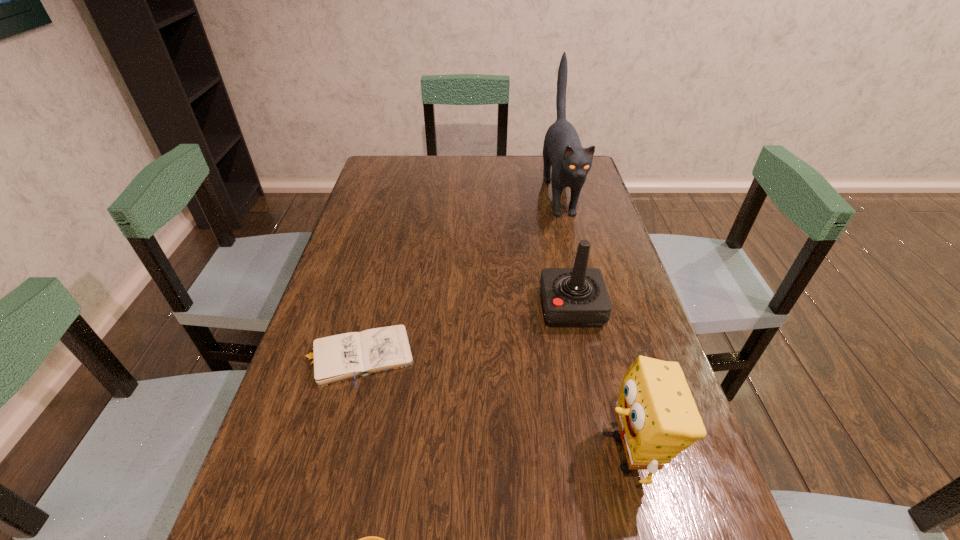
Where is `the farthest object`? This screenshot has width=960, height=540. the farthest object is located at coordinates (562, 150).

Identify the location of the tallest object. Image resolution: width=960 pixels, height=540 pixels. point(562,150).

Where is `joystick`? This screenshot has width=960, height=540. joystick is located at coordinates (572, 297).

This screenshot has width=960, height=540. In order to click on sponge in this screenshot , I will do 657,417.

This screenshot has width=960, height=540. I want to click on the shortest object, so point(337,358).

Where is `vacant space located 0.100m at the face of the cat`? vacant space located 0.100m at the face of the cat is located at coordinates (575, 256).

This screenshot has width=960, height=540. I want to click on free space located 0.250m on the front-facing side of the joystick, so click(443, 307).

Where is `blank area located 0.080m on the front-facing side of the joystick`? The image size is (960, 540). blank area located 0.080m on the front-facing side of the joystick is located at coordinates (510, 307).

The width and height of the screenshot is (960, 540). I want to click on blank area located 0.210m on the front-facing side of the joystick, so click(x=459, y=307).

In order to click on free point located on the face of the sponge in this screenshot , I will do `click(526, 453)`.